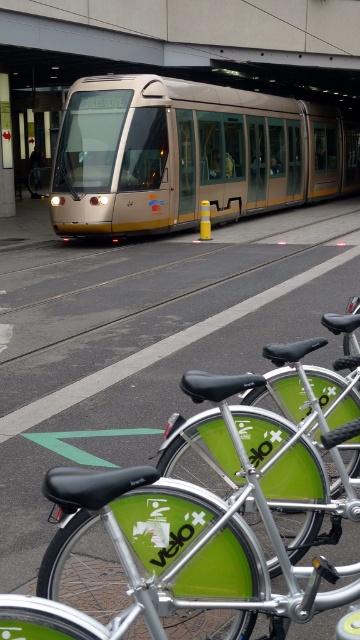
You are at the tram station and need to choose between the green metallic bicycle at lower center and the green matte bicycle at lower center for a quick ride. Which bicycle would be easier to spot from a distance?

The green metallic bicycle at lower center has a larger size compared to the green matte bicycle at lower center, making it easier to spot from a distance.

You are a passenger waiting at the tram station. You see the gold metallic train at center and the green matte bicycle at center. Which one is positioned higher from the ground?

The gold metallic train at center is positioned higher from the ground than the green matte bicycle at center according to the description.